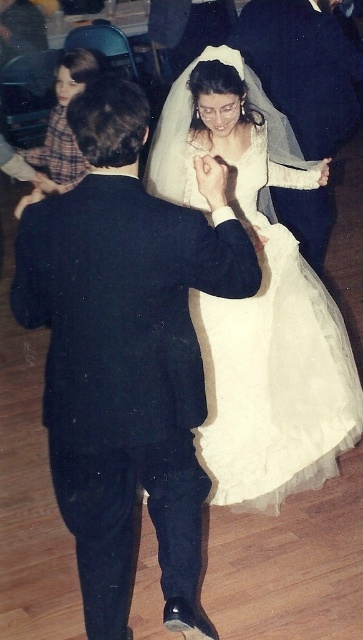
Where is the dark blue suit at center located in the image?

The dark blue suit at center is located at point 0.553 on the x axis and 0.350 on the y axis.

You are a photographer at the wedding reception. You need to capture a closeup of both the dark blue suit at center and the matte black suit at center. Since your camera can only focus on one subject at a time, which suit should you choose to ensure the other is still in focus?

The dark blue suit at center is thinner than the matte black suit at center, so you should focus on the matte black suit at center because its larger size will keep the thinner dark blue suit at center within the depth of field.